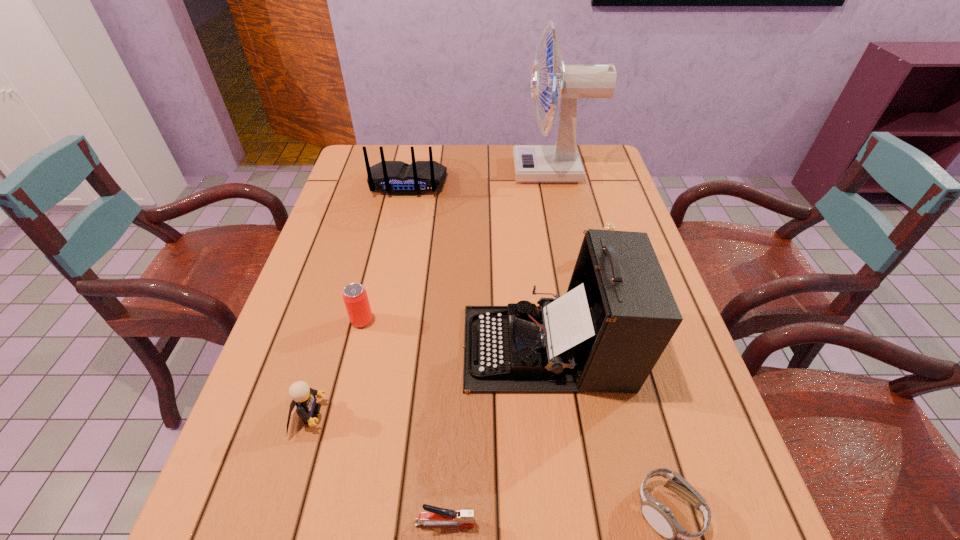
Locate an element on the screen. The width and height of the screenshot is (960, 540). vacant area between the seventh shortest object and the beer can is located at coordinates (455, 334).

Find the location of a particular element. The image size is (960, 540). free space between the tallest object and the beer can is located at coordinates (458, 246).

Where is `the fourth closest object relative to the stapler`? the fourth closest object relative to the stapler is located at coordinates (355, 297).

Locate an element on the screen. the second closest object to the router is located at coordinates (606, 334).

What are the coordinates of `vacant area in the image that satisfies the following two spatial constraints: 1. on the front side of the beer can; 2. on the front-facing side of the nearer Lego` in the screenshot? It's located at (339, 415).

At what (x,y) coordinates should I click in order to perform the action: click on vacant space that satisfies the following two spatial constraints: 1. on the front-facing side of the right Lego; 2. on the handle side of the stapler. Please return your answer as a coordinate pair (x, y). This screenshot has height=540, width=960. Looking at the image, I should click on (680, 523).

In order to click on free space in the image that satisfies the following two spatial constraints: 1. on the front side of the beer can; 2. on the front-facing side of the left Lego in this screenshot , I will do `click(339, 415)`.